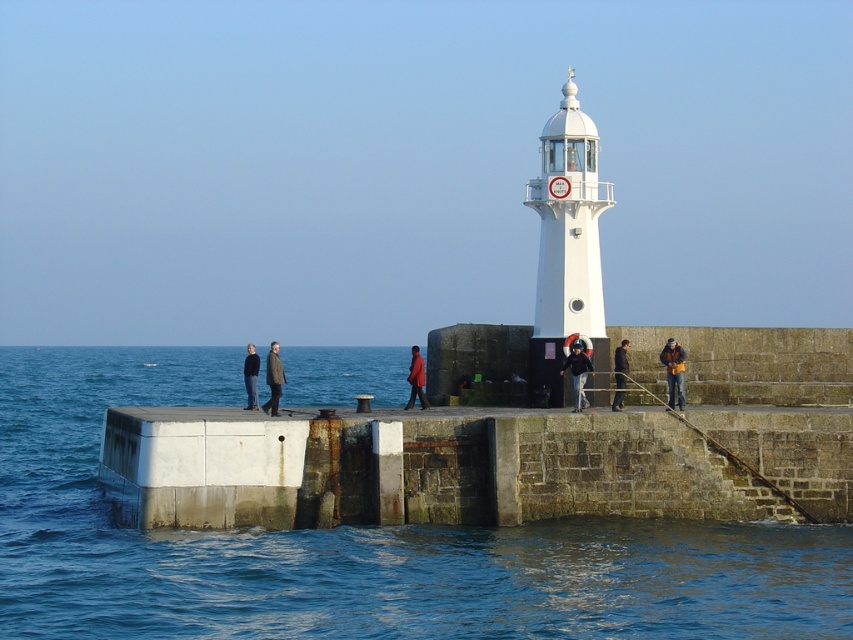
Does white glossy lighthouse at center have a lesser width compared to matte red coat at center?

Incorrect, white glossy lighthouse at center's width is not less than matte red coat at center's.

Is white glossy lighthouse at center to the right of matte red coat at center from the viewer's perspective?

Indeed, white glossy lighthouse at center is positioned on the right side of matte red coat at center.

This screenshot has height=640, width=853. Identify the location of white glossy lighthouse at center. (566, 244).

Between rusty concrete dock at lower center and dark blue jacket at center, which one has less height?

With less height is dark blue jacket at center.

Does rusty concrete dock at lower center have a lesser height compared to dark blue jacket at center?

No.

In order to click on rusty concrete dock at lower center in this screenshot , I will do `click(469, 467)`.

This screenshot has height=640, width=853. Identify the location of rusty concrete dock at lower center. [469, 467].

Is dark blue jacket at center positioned before matte red coat at center?

That is True.

Can you confirm if dark blue jacket at center is shorter than matte red coat at center?

Yes, dark blue jacket at center is shorter than matte red coat at center.

Does point (578, 378) come closer to viewer compared to point (415, 396)?

Yes, point (578, 378) is in front of point (415, 396).

Where is `dark blue jacket at center`? The width and height of the screenshot is (853, 640). dark blue jacket at center is located at coordinates (577, 372).